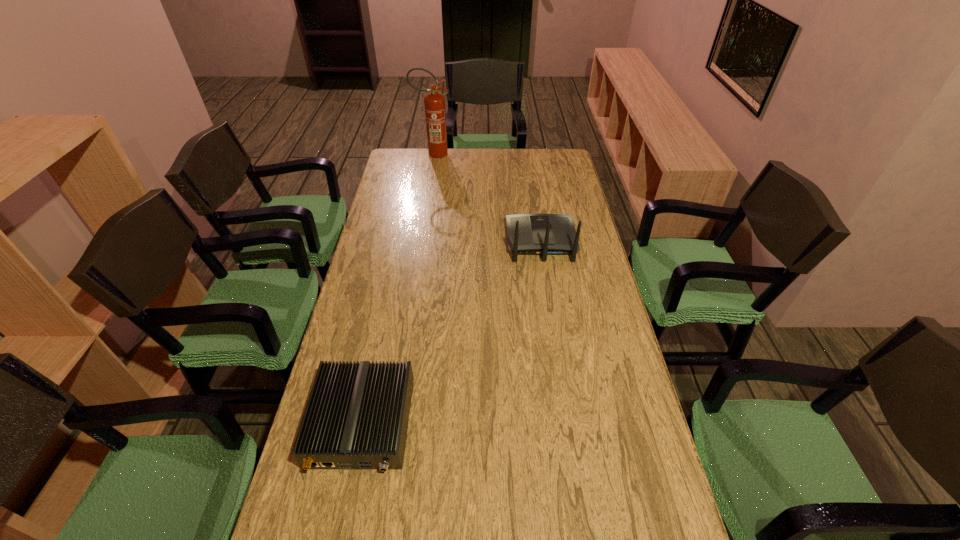
The width and height of the screenshot is (960, 540). Find the location of `vacant space positioned on the back panel of the left router`. vacant space positioned on the back panel of the left router is located at coordinates (340, 530).

Where is `object that is positioned at the far edge`? The image size is (960, 540). object that is positioned at the far edge is located at coordinates (435, 113).

Find the location of a particular element. fire extinguisher situated at the left edge is located at coordinates (435, 113).

Locate an element on the screen. router at the left edge is located at coordinates (357, 415).

This screenshot has width=960, height=540. I want to click on object at the right edge, so click(528, 234).

Where is `object located in the far left corner section of the desktop`? The height and width of the screenshot is (540, 960). object located in the far left corner section of the desktop is located at coordinates (435, 113).

Locate an element on the screen. The width and height of the screenshot is (960, 540). vacant area at the far edge of the desktop is located at coordinates (476, 156).

This screenshot has width=960, height=540. Find the location of `vacant region at the left edge of the desktop`. vacant region at the left edge of the desktop is located at coordinates (418, 184).

Identify the location of vacant space at the far left corner. (420, 153).

Identify the location of free area in between the right router and the farthest object. This screenshot has height=540, width=960. (487, 198).